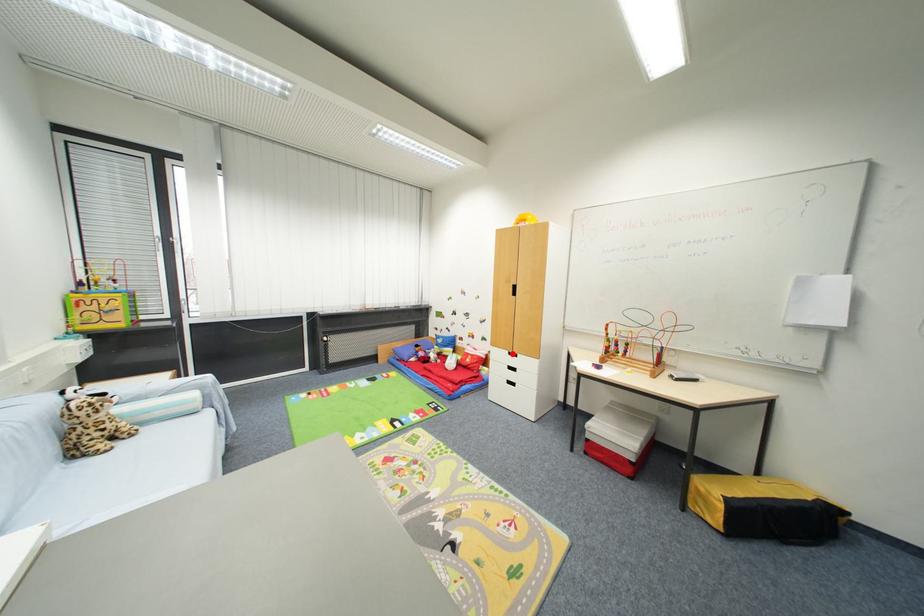
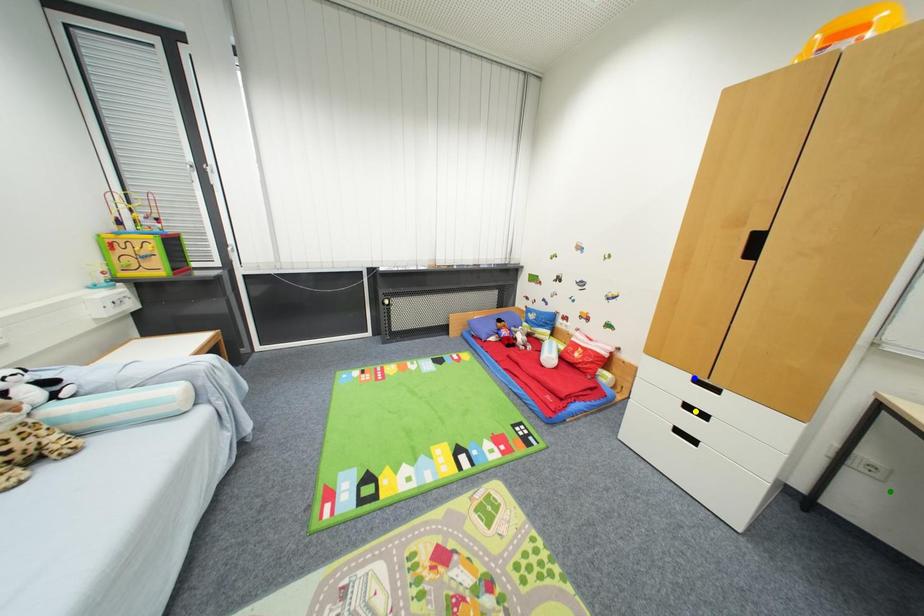
Question: I am providing you with two images of the same scene from different viewpoints. A red point is marked on the first image. You are given multiple points on the second image. Which point in image 2 represents the same 3d spot as the red point in image 1?

Choices:
 (A) yellow point
 (B) green point
 (C) blue point

Answer: (C)